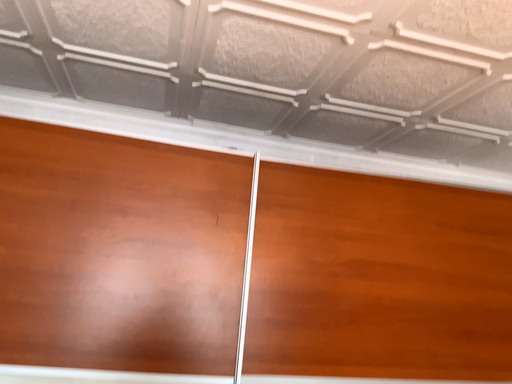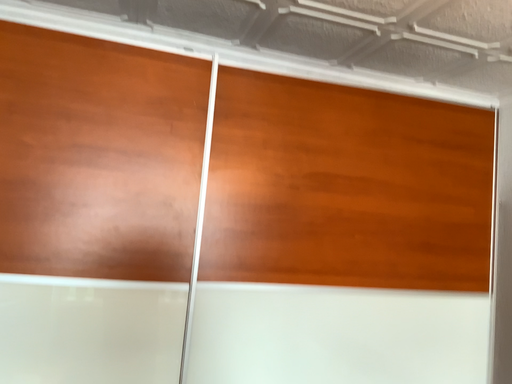
Question: How did the camera likely rotate when shooting the video?

Choices:
 (A) rotated upward
 (B) rotated downward

Answer: (B)